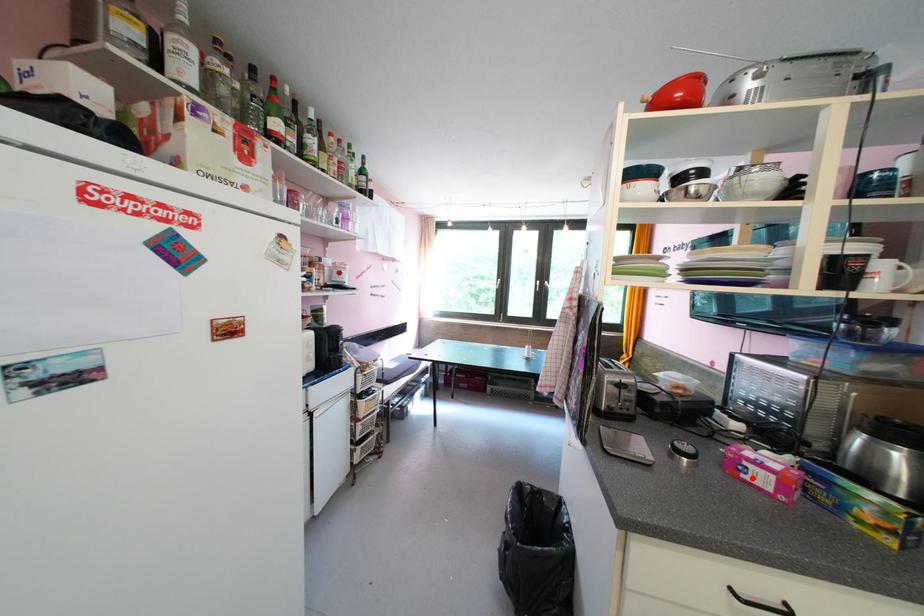
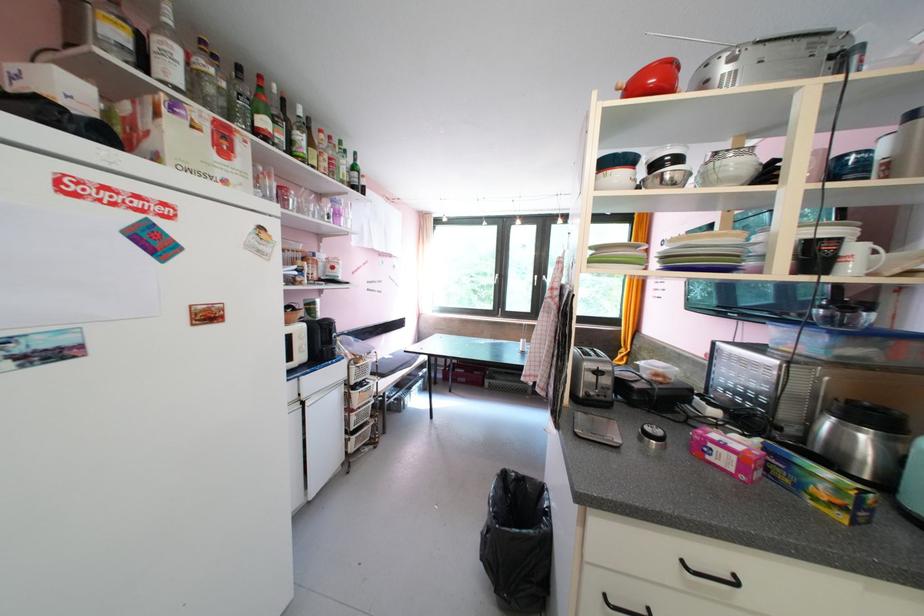
Question: I am providing you with two images of the same scene from different viewpoints. A red point is marked on the first image. At the location where the point appears in image 1, is it still visible in image 2?

Choices:
 (A) Yes
 (B) No

Answer: (A)